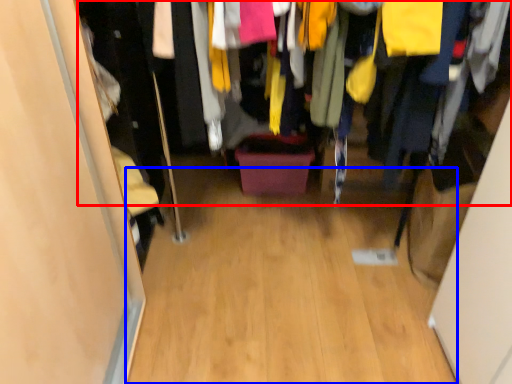
Question: Among these objects, which one is farthest to the camera, closet (highlighted by a red box) or plain (highlighted by a blue box)?

Choices:
 (A) closet
 (B) plain

Answer: (B)